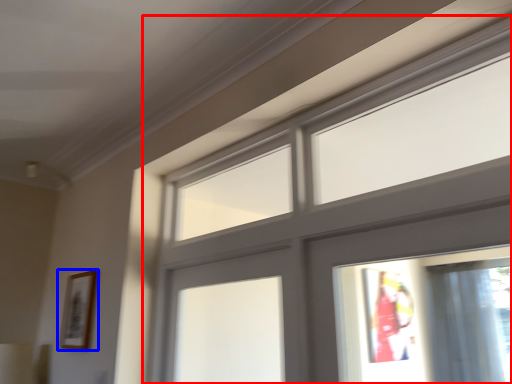
Question: Which of the following is the closest to the observer, window (highlighted by a red box) or picture frame (highlighted by a blue box)?

Choices:
 (A) window
 (B) picture frame

Answer: (A)